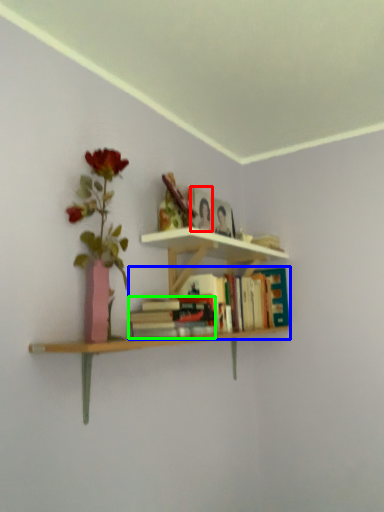
Question: Considering the real-world distances, which object is farthest from paperback book (highlighted by a red box)? book (highlighted by a blue box) or book (highlighted by a green box)?

Choices:
 (A) book
 (B) book

Answer: (B)